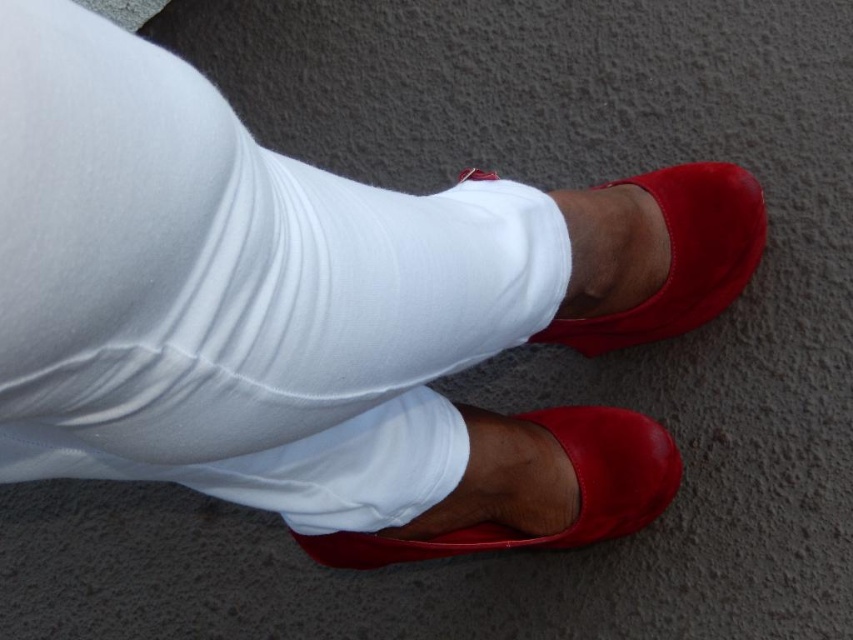
Can you confirm if shiny leather shoe at lower center is wider than satin red shoe at center?

Yes, shiny leather shoe at lower center is wider than satin red shoe at center.

Which is more to the left, shiny leather shoe at lower center or satin red shoe at center?

Positioned to the left is shiny leather shoe at lower center.

What do you see at coordinates (577, 493) in the screenshot? This screenshot has width=853, height=640. I see `shiny leather shoe at lower center` at bounding box center [577, 493].

What are the coordinates of `shiny leather shoe at lower center` in the screenshot? It's located at (577, 493).